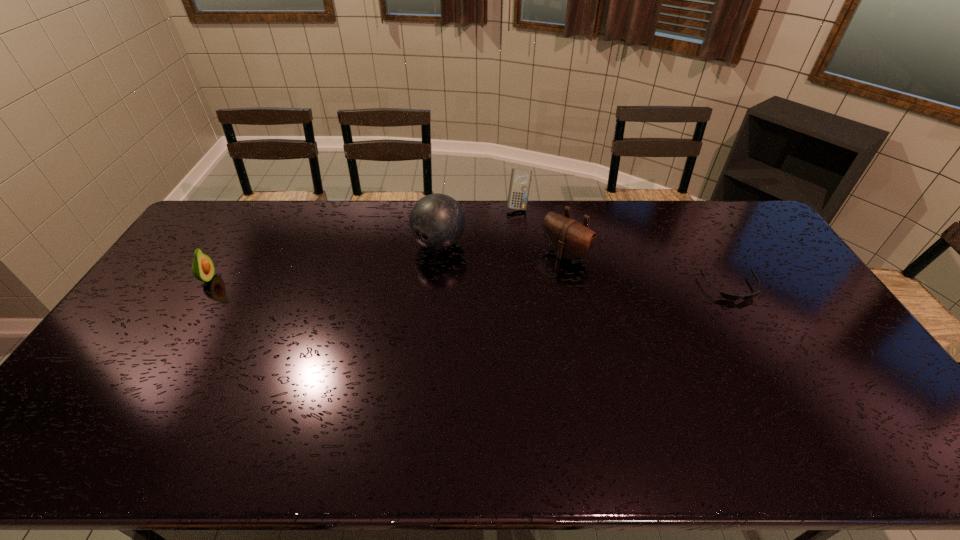
This screenshot has height=540, width=960. In order to click on bowling ball that is positioned at the far edge in this screenshot , I will do `click(437, 221)`.

Where is `calculator at the far edge`? The width and height of the screenshot is (960, 540). calculator at the far edge is located at coordinates (520, 180).

Identify the location of pouch positioned at the far edge. The image size is (960, 540). pyautogui.click(x=568, y=238).

The height and width of the screenshot is (540, 960). I want to click on object at the left edge, so click(x=203, y=269).

Where is `object present at the right edge`? object present at the right edge is located at coordinates (730, 297).

I want to click on vacant space at the far edge of the desktop, so click(x=644, y=205).

The width and height of the screenshot is (960, 540). Identify the location of blank space at the near edge. (742, 411).

Locate an element on the screen. This screenshot has height=540, width=960. free location at the left edge is located at coordinates (132, 367).

In the image, there is a desktop. Find the location of `free space at the right edge`. free space at the right edge is located at coordinates (786, 305).

In order to click on free space between the bowling ball and the pouch in this screenshot , I will do `click(502, 248)`.